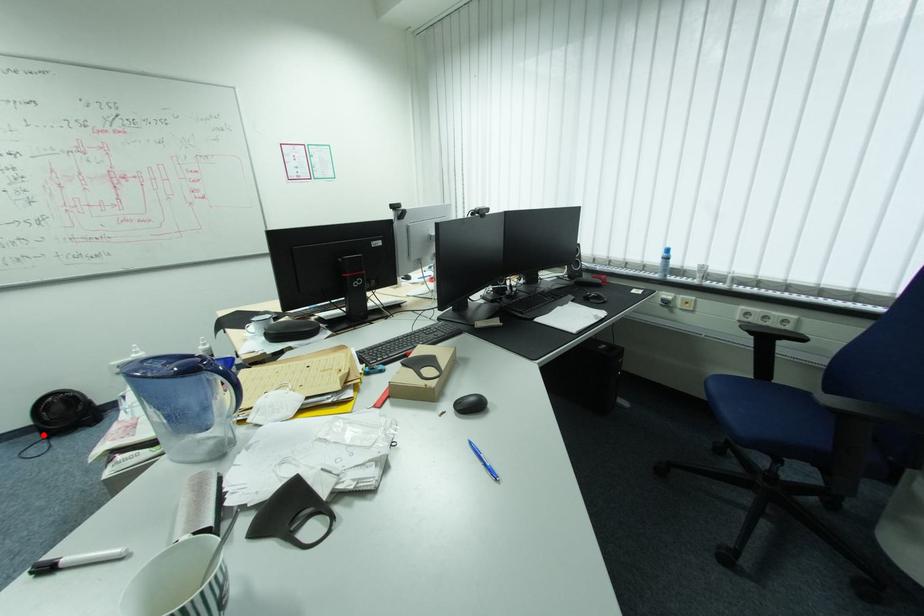
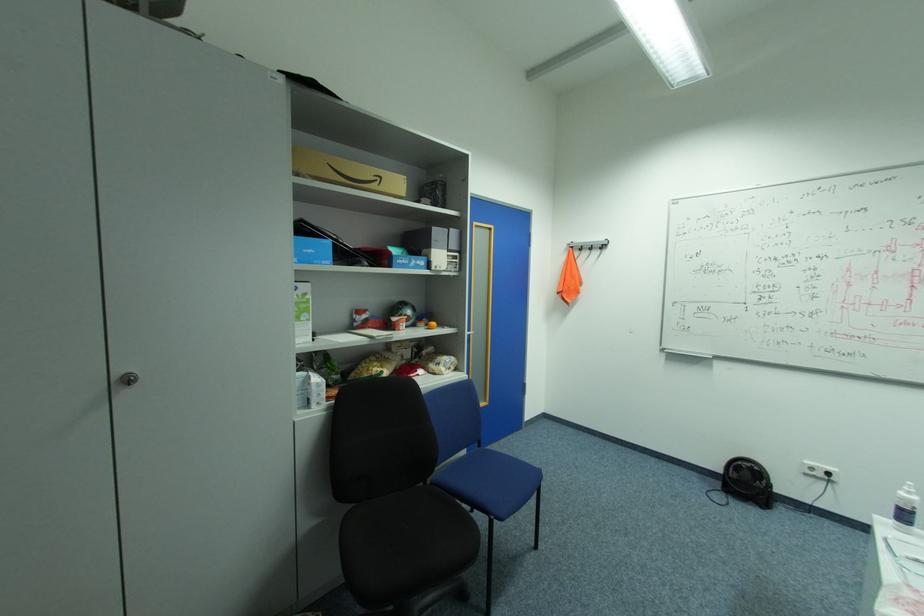
Question: I am providing you with two images of the same scene from different viewpoints. In image1, a red point is highlighted. Considering the same 3D point in image2, which of the following is correct?

Choices:
 (A) It is closer
 (B) It is farther

Answer: (B)